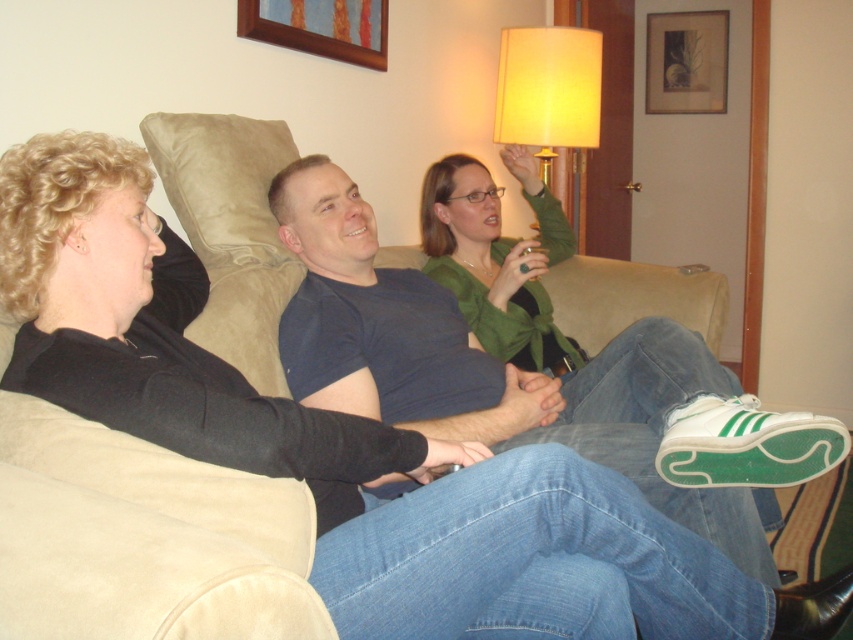
Question: Can you confirm if blue cotton t-shirt at center is smaller than yellow fabric lampshade at upper center?

Choices:
 (A) no
 (B) yes

Answer: (A)

Question: Is blue cotton t-shirt at center in front of yellow fabric lampshade at upper center?

Choices:
 (A) yes
 (B) no

Answer: (A)

Question: Does blue cotton t-shirt at center come behind yellow fabric lampshade at upper center?

Choices:
 (A) yes
 (B) no

Answer: (B)

Question: Which of the following is the closest to the observer?

Choices:
 (A) (592, 120)
 (B) (709, 508)

Answer: (B)

Question: Which point is closer to the camera?

Choices:
 (A) yellow fabric lampshade at upper center
 (B) blue cotton t-shirt at center

Answer: (B)